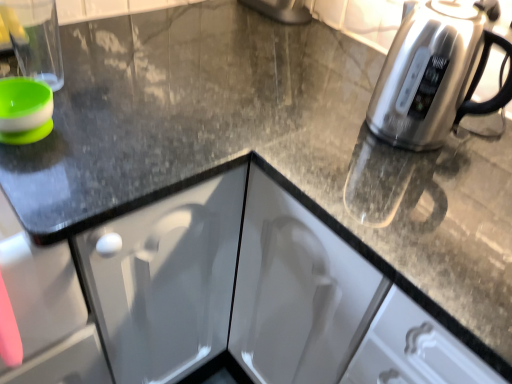
The width and height of the screenshot is (512, 384). In order to click on free location in front of transparent plastic cup at upper left in this screenshot , I will do `click(67, 106)`.